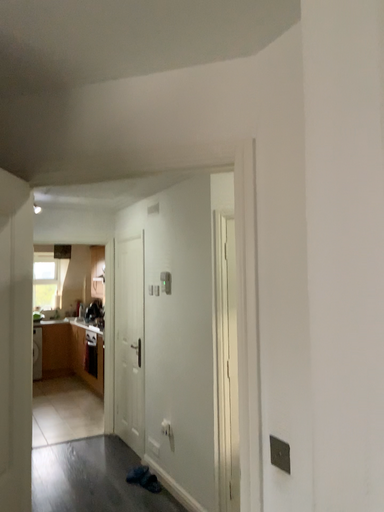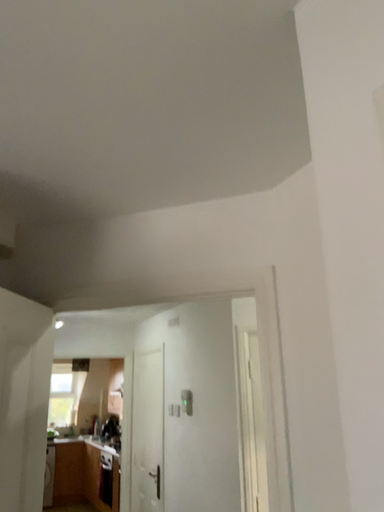
Question: How did the camera likely rotate when shooting the video?

Choices:
 (A) rotated upward
 (B) rotated downward

Answer: (A)